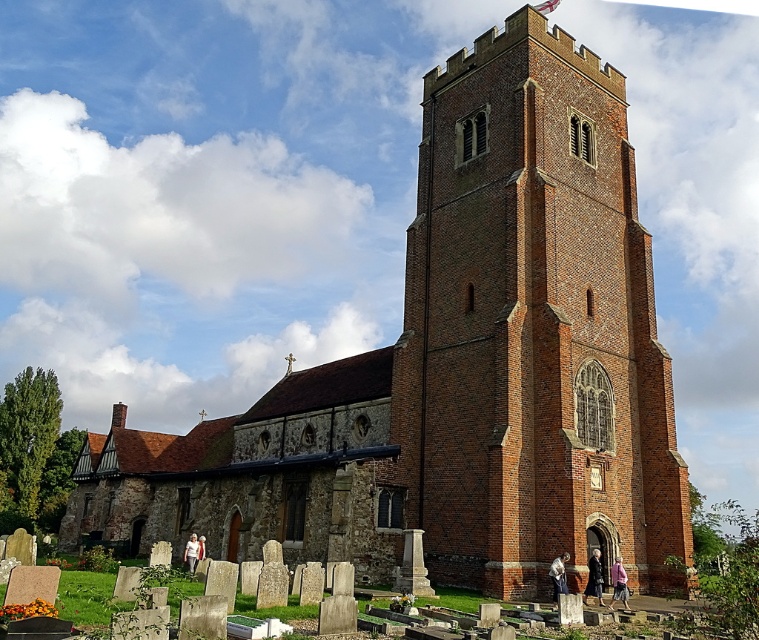
Question: Based on their relative distances, which object is farther from the white fabric at center?

Choices:
 (A) brick tower at center
 (B) dark gray wool coat at lower center
 (C) pink fabric pants at lower right

Answer: (A)

Question: Can you confirm if dark gray wool coat at lower center is positioned below blue denim jeans at lower center?

Choices:
 (A) yes
 (B) no

Answer: (A)

Question: Is the position of dark gray wool coat at lower center more distant than that of blue denim jeans at lower center?

Choices:
 (A) no
 (B) yes

Answer: (B)

Question: Estimate the real-world distances between objects in this image. Which object is farther from the brick tower at center?

Choices:
 (A) pink fabric pants at lower right
 (B) dark gray wool coat at lower center
 (C) blue denim jeans at lower center

Answer: (A)

Question: Is pink fabric pants at lower right below blue denim jeans at lower center?

Choices:
 (A) no
 (B) yes

Answer: (B)

Question: Which object appears farthest from the camera in this image?

Choices:
 (A) brick tower at center
 (B) blue denim jeans at lower center

Answer: (A)